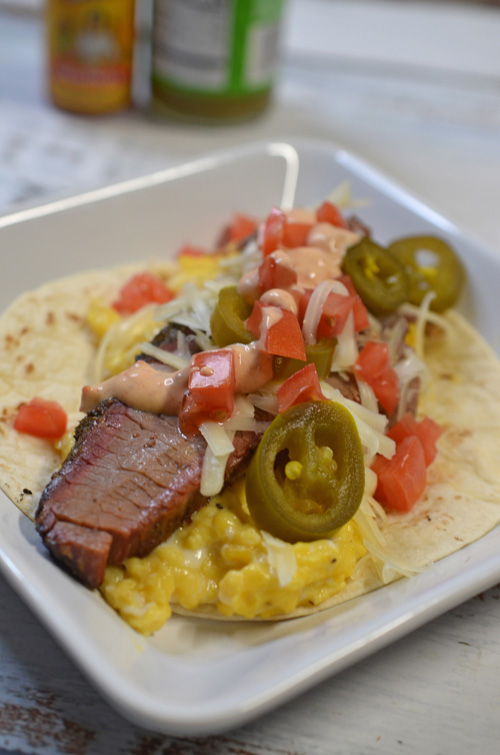
You are a GUI agent. You are given a task and a screenshot of the screen. Output one action in this format:
    pyautogui.click(x=<x>, y=<y>)
    Task: Click on the table
    This screenshot has height=755, width=500.
    Given the screenshot: What is the action you would take?
    pyautogui.click(x=347, y=698)